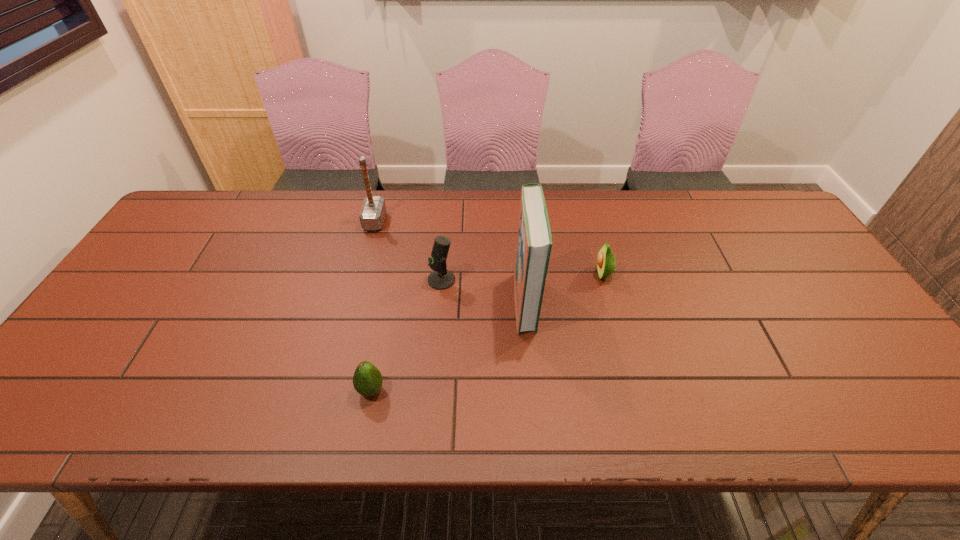
Image resolution: width=960 pixels, height=540 pixels. Identify the location of vacant region that satisfies the following two spatial constraints: 1. on the striking surface of the farthest object; 2. on the right side of the shortest object. (331, 390).

This screenshot has width=960, height=540. What are the coordinates of `vacant region that satisfies the following two spatial constraints: 1. on the back side of the microphone; 2. on the striking surface of the leftmost object` in the screenshot? It's located at (446, 221).